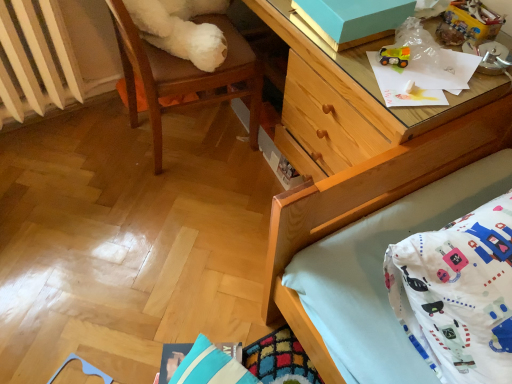
The height and width of the screenshot is (384, 512). Describe the element at coordinates (211, 366) in the screenshot. I see `blue striped pillow at lower center` at that location.

The width and height of the screenshot is (512, 384). I want to click on plastic toy car at upper right, the first toy from the right, so click(x=468, y=23).

Where is `matte blue cardboard box at upper right`? matte blue cardboard box at upper right is located at coordinates (353, 19).

Where is `white plastic radiator at left`? white plastic radiator at left is located at coordinates (40, 54).

This screenshot has height=384, width=512. Find the location of `white cotton pillow at lower right`. white cotton pillow at lower right is located at coordinates (458, 294).

Looking at this image, measure the distance between point (359, 206) and camera.

Point (359, 206) and camera are 1.08 meters apart.

The width and height of the screenshot is (512, 384). I want to click on blue striped pillow at lower center, so click(211, 366).

Is matte blue cardboard box at upper right at the right side of blue striped pillow at lower center?

Indeed, matte blue cardboard box at upper right is positioned on the right side of blue striped pillow at lower center.

Are matte blue cardboard box at upper right and blue striped pillow at lower center located far from each other?

No.

Which point is more distant from viewer, (347, 46) or (208, 345)?

The point (208, 345) is farther from the camera.

Looking at their sizes, would you say white cotton pillow at lower right is wider or thinner than white plastic radiator at left?

white cotton pillow at lower right is wider than white plastic radiator at left.

Which of these two, white cotton pillow at lower right or white plastic radiator at left, stands shorter?

Standing shorter between the two is white cotton pillow at lower right.

Is white cotton pillow at lower right touching white plastic radiator at left?

No, white cotton pillow at lower right is not in contact with white plastic radiator at left.

Is point (481, 208) closer to camera compared to point (29, 104)?

That is True.

Is blue striped pillow at lower center thinner than wooden chair at upper left?

Yes.

From the image's perspective, is blue striped pillow at lower center located above wooden chair at upper left?

No.

Is point (234, 360) in front of point (129, 106)?

Yes, point (234, 360) is in front of point (129, 106).

Looking at this image, is blue striped pillow at lower center facing towards wooden desk at upper right?

No, blue striped pillow at lower center is not facing towards wooden desk at upper right.

Can you tell me how much blue striped pillow at lower center and wooden desk at upper right differ in facing direction?

The angular difference between blue striped pillow at lower center and wooden desk at upper right is 22.6 degrees.

Which of these two, blue striped pillow at lower center or wooden desk at upper right, stands taller?

wooden desk at upper right is taller.

Is blue striped pillow at lower center next to wooden desk at upper right and touching it?

No.

Considering the sizes of objects white plastic radiator at left and wooden desk at upper right in the image provided, who is smaller, white plastic radiator at left or wooden desk at upper right?

With smaller size is white plastic radiator at left.

Would you say white plastic radiator at left is inside or outside wooden desk at upper right?

white plastic radiator at left cannot be found inside wooden desk at upper right.

Is white plastic radiator at left positioned in front of wooden desk at upper right?

No, it is behind wooden desk at upper right.

Is white plastic radiator at left oriented towards wooden desk at upper right?

No.

From a real-world perspective, is matte blue cardboard box at upper right on plastic toy car at upper right, the 1th toy in the top-to-bottom sequence?

No.

Who is smaller, matte blue cardboard box at upper right or plastic toy car at upper right, positioned as the second toy in left-to-right order?

plastic toy car at upper right, positioned as the second toy in left-to-right order.

From the image's perspective, which one is positioned lower, matte blue cardboard box at upper right or plastic toy car at upper right, the first toy from the right?

From the image's view, matte blue cardboard box at upper right is below.

This screenshot has height=384, width=512. I want to click on toy that is above the matte blue cardboard box at upper right (from the image's perspective), so click(468, 23).

In the scene shown: Between wooden desk at upper right and wooden chair at upper left, which one appears on the right side from the viewer's perspective?

wooden desk at upper right.

Considering the positions of points (337, 275) and (242, 44), is point (337, 275) farther from camera compared to point (242, 44)?

No, it is not.

Between wooden desk at upper right and wooden chair at upper left, which one has smaller size?

wooden chair at upper left is smaller.

Choose the correct answer: Is wooden desk at upper right inside wooden chair at upper left or outside it?

wooden desk at upper right exists outside the volume of wooden chair at upper left.

Find the location of `box above the blue striped pillow at lower center (from a real-world perspective)`. box above the blue striped pillow at lower center (from a real-world perspective) is located at coordinates (353, 19).

Identify the location of radiator located behind the white cotton pillow at lower right. (40, 54).

Estimate the real-world distances between objects in this image. Which object is further from wooden chair at upper left, wooden desk at upper right or matte blue cardboard box at upper right?

wooden desk at upper right.

Which object lies further to the anchor point white cotton pillow at lower right, wooden chair at upper left or rubberized yellow toy truck at upper right, the first toy positioned from the left?

wooden chair at upper left is positioned further to the anchor white cotton pillow at lower right.

Considering their positions, is white plastic radiator at left positioned closer to rubberized yellow toy truck at upper right, the 1th toy from the bottom, than wooden desk at upper right?

wooden desk at upper right is closer to rubberized yellow toy truck at upper right, the 1th toy from the bottom.

Based on the photo, considering their positions, is white cotton pillow at lower right positioned further to rubberized yellow toy truck at upper right, the 1th toy from the bottom, than blue striped pillow at lower center?

blue striped pillow at lower center is positioned further to the anchor rubberized yellow toy truck at upper right, the 1th toy from the bottom.

Which object lies nearer to the anchor point wooden chair at upper left, plastic toy car at upper right, the 1th toy in the top-to-bottom sequence, or white plastic radiator at left?

white plastic radiator at left is closer to wooden chair at upper left.

From the image, which object appears to be farther from white cotton pillow at lower right, wooden chair at upper left or matte blue cardboard box at upper right?

Based on the image, wooden chair at upper left appears to be further to white cotton pillow at lower right.

Estimate the real-world distances between objects in this image. Which object is closer to plastic toy car at upper right, acting as the second toy starting from the bottom, white cotton pillow at lower right or wooden chair at upper left?

white cotton pillow at lower right is positioned closer to the anchor plastic toy car at upper right, acting as the second toy starting from the bottom.

Based on their spatial positions, is white cotton pillow at lower right or blue striped pillow at lower center closer to wooden desk at upper right?

white cotton pillow at lower right is closer to wooden desk at upper right.

Locate an element on the screen. The height and width of the screenshot is (384, 512). desk between plastic toy car at upper right, the first toy from the right, and blue striped pillow at lower center vertically is located at coordinates (354, 157).

At what (x,y) coordinates should I click in order to perform the action: click on throw pillow between wooden desk at upper right and blue striped pillow at lower center in the up-down direction. Please return your answer as a coordinate pair (x, y). Looking at the image, I should click on (458, 294).

Find the location of a particular element. box between white plastic radiator at left and blue striped pillow at lower center vertically is located at coordinates (353, 19).

Locate an element on the screen. Image resolution: width=512 pixels, height=384 pixels. box situated between wooden chair at upper left and plastic toy car at upper right, acting as the second toy starting from the bottom, from left to right is located at coordinates (353, 19).